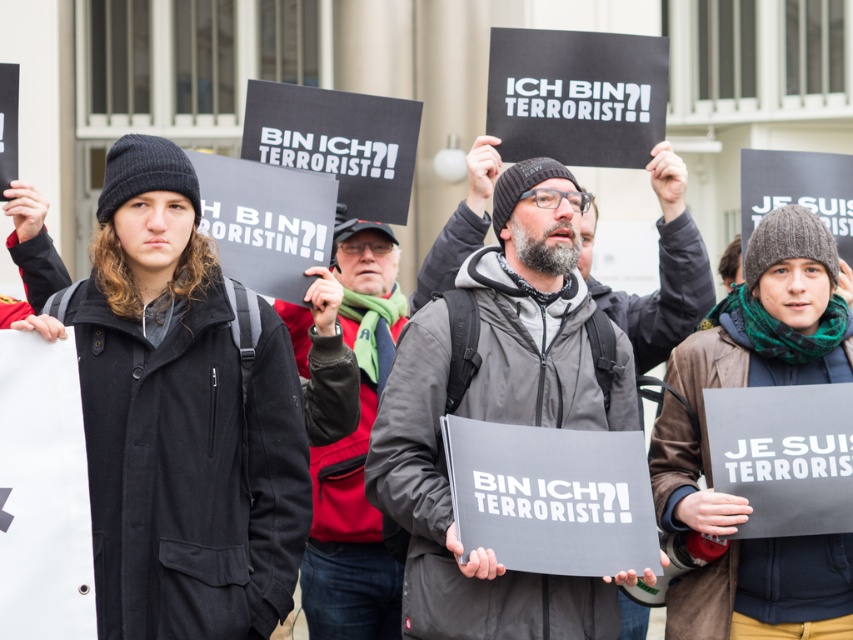
You are a photographer trying to capture a closeup of both the gray fabric jacket at center and the matte black jacket at center in the protest scene. Given that your camera can only focus on one jacket at a time, which jacket should you adjust the focus for first to ensure the wider jacket is in clear view?

The gray fabric jacket at center has a larger width than the matte black jacket at center, so you should adjust the focus for the gray fabric jacket at center first to ensure its entire width is captured clearly.